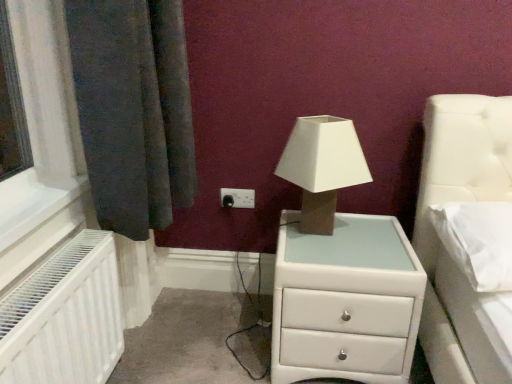
Image resolution: width=512 pixels, height=384 pixels. What do you see at coordinates (322, 167) in the screenshot?
I see `matte beige cardboard at center` at bounding box center [322, 167].

Looking at this image, what is the approximate width of white plastic electric outlet at center?

It is 0.95 inches.

What do you see at coordinates (237, 198) in the screenshot? The height and width of the screenshot is (384, 512). I see `white plastic electric outlet at center` at bounding box center [237, 198].

Where is `white glossy chest of drawers at center`? white glossy chest of drawers at center is located at coordinates (346, 302).

Locate an element on the screen. The image size is (512, 384). matte beige cardboard at center is located at coordinates (322, 167).

From a real-world perspective, relative to white glossy chest of drawers at center, is matte beige cardboard at center vertically above or below?

matte beige cardboard at center is situated higher than white glossy chest of drawers at center in the real world.

Which of these two, matte beige cardboard at center or white glossy chest of drawers at center, stands shorter?

matte beige cardboard at center.

Which of these two, matte beige cardboard at center or white glossy chest of drawers at center, is thinner?

matte beige cardboard at center is thinner.

How distant is matte beige cardboard at center from white glossy chest of drawers at center?

The distance of matte beige cardboard at center from white glossy chest of drawers at center is 10.23 inches.

Is white soft pillow at right inside or outside of white glossy chest of drawers at center?

white soft pillow at right exists outside the volume of white glossy chest of drawers at center.

Image resolution: width=512 pixels, height=384 pixels. Find the location of `pillow located in front of the white glossy chest of drawers at center`. pillow located in front of the white glossy chest of drawers at center is located at coordinates (478, 241).

Looking at this image, between white soft pillow at right and white glossy chest of drawers at center, which one has less height?

white soft pillow at right is shorter.

From their relative heights in the image, would you say white glossy chest of drawers at center is taller or shorter than white soft pillow at right?

Clearly, white glossy chest of drawers at center is taller compared to white soft pillow at right.

Between white glossy chest of drawers at center and white soft pillow at right, which one has smaller size?

white soft pillow at right is smaller.

Is white glossy chest of drawers at center looking in the opposite direction of white soft pillow at right?

→ No, white glossy chest of drawers at center's orientation is not away from white soft pillow at right.

In the scene shown: Which is farther, [385,265] or [489,245]?

Positioned behind is point [385,265].

Which is more to the right, white soft pillow at right or white plastic electric outlet at center?

From the viewer's perspective, white soft pillow at right appears more on the right side.

Does white soft pillow at right touch white plastic electric outlet at center?

white soft pillow at right and white plastic electric outlet at center are not in contact.

From a real-world perspective, is white soft pillow at right below white plastic electric outlet at center?

No, from a real-world perspective, white soft pillow at right is not below white plastic electric outlet at center.

From the image's perspective, between white soft pillow at right and matte beige cardboard at center, which one is located above?

matte beige cardboard at center.

Can you confirm if white soft pillow at right is taller than matte beige cardboard at center?

Incorrect, the height of white soft pillow at right is not larger of that of matte beige cardboard at center.

Is white soft pillow at right in contact with matte beige cardboard at center?

No, white soft pillow at right is not touching matte beige cardboard at center.

Is point (471, 236) closer to camera compared to point (298, 166)?

Yes, it is.

In the scene shown: Can you confirm if white plastic electric outlet at center is taller than white soft pillow at right?

No.

Do you think white plastic electric outlet at center is within white soft pillow at right, or outside of it?

white plastic electric outlet at center exists outside the volume of white soft pillow at right.

Identify the location of electric outlet on the left of white soft pillow at right. This screenshot has width=512, height=384. pyautogui.click(x=237, y=198).

Considering the sizes of objects matte beige cardboard at center and white soft pillow at right in the image provided, who is bigger, matte beige cardboard at center or white soft pillow at right?

matte beige cardboard at center.

Is matte beige cardboard at center outside of white soft pillow at right?

That's correct, matte beige cardboard at center is outside of white soft pillow at right.

From the image's perspective, is matte beige cardboard at center above or below white soft pillow at right?

Based on their image positions, matte beige cardboard at center is located above white soft pillow at right.

The width and height of the screenshot is (512, 384). Identify the location of chest of drawers in front of the matte beige cardboard at center. (346, 302).

The width and height of the screenshot is (512, 384). In order to click on chest of drawers lying on the left of white soft pillow at right in this screenshot , I will do `click(346, 302)`.

Which object lies nearer to the anchor point white soft pillow at right, matte beige cardboard at center or white glossy chest of drawers at center?

The object closer to white soft pillow at right is white glossy chest of drawers at center.

Estimate the real-world distances between objects in this image. Which object is closer to white glossy chest of drawers at center, matte beige cardboard at center or white soft pillow at right?

The object closer to white glossy chest of drawers at center is matte beige cardboard at center.

Estimate the real-world distances between objects in this image. Which object is closer to white soft pillow at right, matte beige cardboard at center or white plastic electric outlet at center?

Among the two, matte beige cardboard at center is located nearer to white soft pillow at right.

Considering their positions, is white plastic electric outlet at center positioned further to white soft pillow at right than white glossy chest of drawers at center?

white plastic electric outlet at center lies further to white soft pillow at right than the other object.

When comparing their distances from white glossy chest of drawers at center, does matte beige cardboard at center or white plastic electric outlet at center seem further?

white plastic electric outlet at center lies further to white glossy chest of drawers at center than the other object.

Considering their positions, is white glossy chest of drawers at center positioned closer to matte beige cardboard at center than white soft pillow at right?

The object closer to matte beige cardboard at center is white glossy chest of drawers at center.

Estimate the real-world distances between objects in this image. Which object is further from white soft pillow at right, white glossy chest of drawers at center or matte beige cardboard at center?

matte beige cardboard at center lies further to white soft pillow at right than the other object.

Estimate the real-world distances between objects in this image. Which object is closer to white glossy chest of drawers at center, white soft pillow at right or white plastic electric outlet at center?

Based on the image, white soft pillow at right appears to be nearer to white glossy chest of drawers at center.

Locate an element on the screen. table lamp between white plastic electric outlet at center and white soft pillow at right is located at coordinates (322, 167).

Identify the location of the chest of drawers located between white plastic electric outlet at center and white soft pillow at right in the left-right direction. (346, 302).

Locate an element on the screen. The height and width of the screenshot is (384, 512). chest of drawers between matte beige cardboard at center and white soft pillow at right in the horizontal direction is located at coordinates (346, 302).

Where is `table lamp located between white glossy chest of drawers at center and white plastic electric outlet at center in the depth direction`? The width and height of the screenshot is (512, 384). table lamp located between white glossy chest of drawers at center and white plastic electric outlet at center in the depth direction is located at coordinates (322, 167).